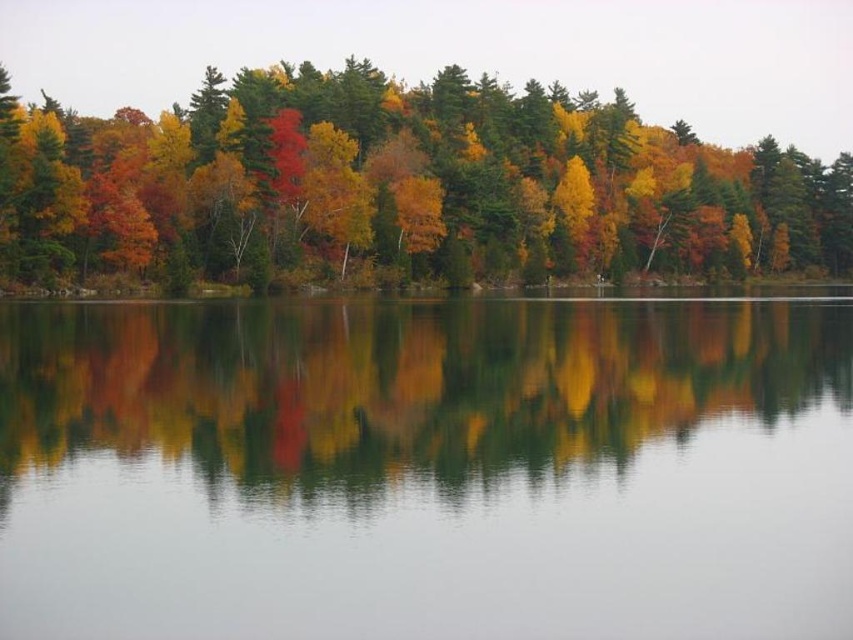
Question: Can you confirm if smooth water at center is positioned to the left of autumn leaves at upper center?

Choices:
 (A) no
 (B) yes

Answer: (B)

Question: Is smooth water at center above autumn leaves at upper center?

Choices:
 (A) no
 (B) yes

Answer: (A)

Question: Is smooth water at center in front of autumn leaves at upper center?

Choices:
 (A) no
 (B) yes

Answer: (B)